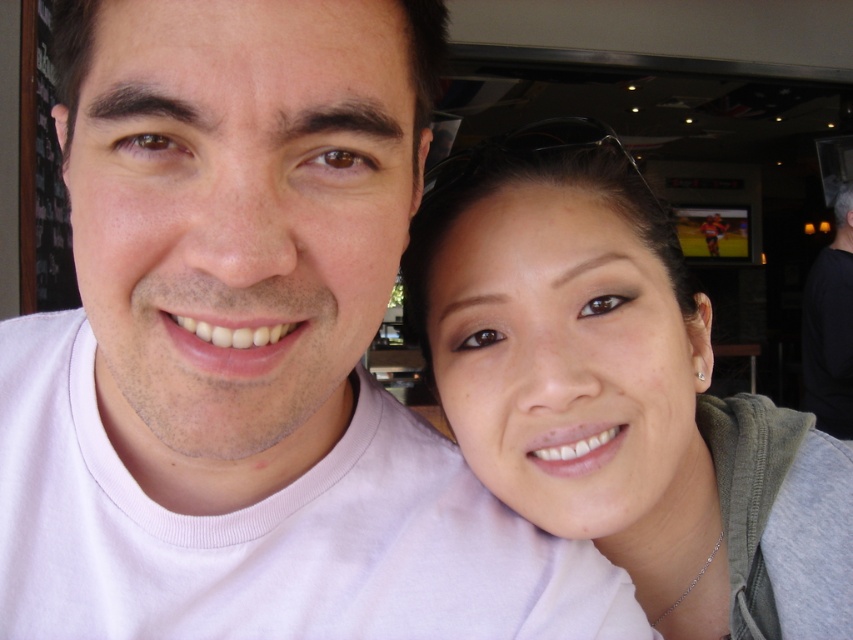
Looking at this image, can you confirm if matte gray hoodie at right is bigger than black matte hair at upper right?

Incorrect, matte gray hoodie at right is not larger than black matte hair at upper right.

Can you confirm if matte gray hoodie at right is positioned below black matte hair at upper right?

Yes.

Locate an element on the screen. matte gray hoodie at right is located at coordinates (619, 390).